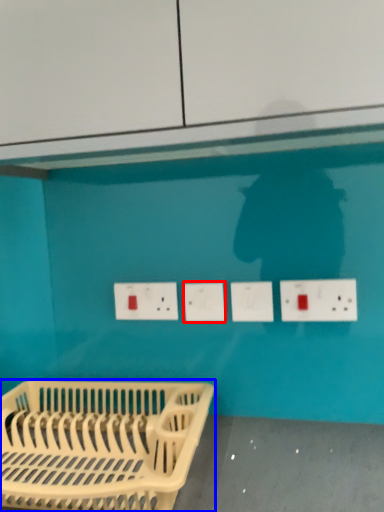
Question: Which of the following is the farthest to the observer, socket (highlighted by a red box) or furniture (highlighted by a blue box)?

Choices:
 (A) socket
 (B) furniture

Answer: (A)